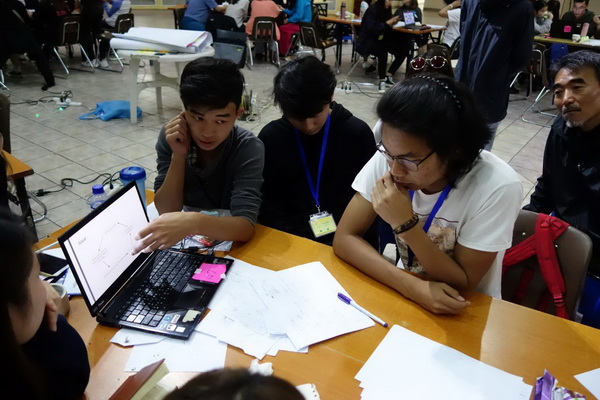
In order to click on phone in this screenshot , I will do `click(61, 263)`.